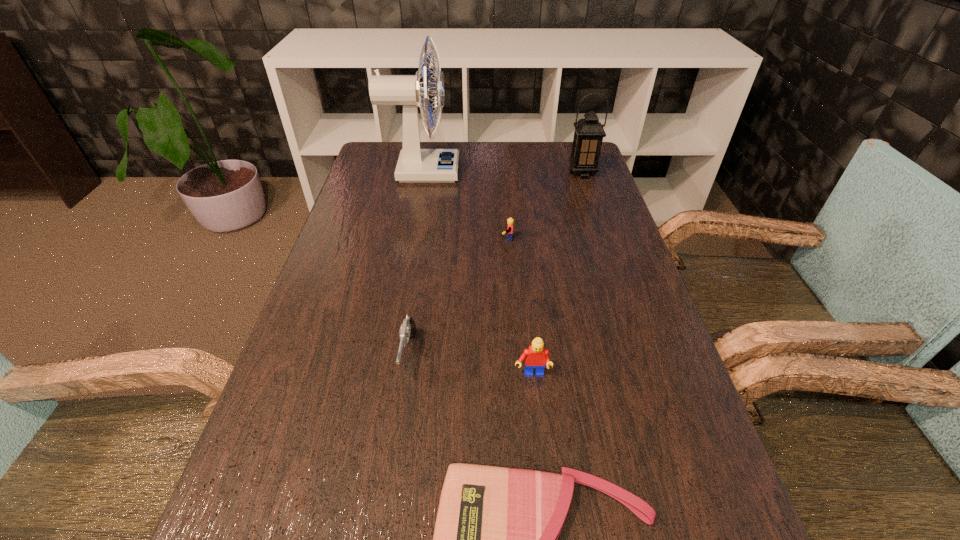
This screenshot has height=540, width=960. Find the location of `fan`. fan is located at coordinates (415, 164).

The height and width of the screenshot is (540, 960). In order to click on lantern in this screenshot , I will do `click(588, 136)`.

Identify the location of the rightmost object. The image size is (960, 540). (588, 136).

Find the location of a particular element. The image size is (960, 540). the nearer Lego is located at coordinates (536, 356).

This screenshot has width=960, height=540. I want to click on the farther Lego, so click(510, 221).

Find the location of a particular element. Image resolution: width=960 pixels, height=540 pixels. gun is located at coordinates (408, 329).

In order to click on free space located 0.360m on the front-facing side of the tallest object in this screenshot , I will do `click(570, 172)`.

Identify the location of vacant space located 0.150m on the left of the rightmost object. The height and width of the screenshot is (540, 960). (521, 173).

The width and height of the screenshot is (960, 540). I want to click on free space located on the front-facing side of the nearer Lego, so click(542, 484).

This screenshot has height=540, width=960. What are the coordinates of `blank space located 0.140m on the front-facing side of the fourth nearest object` in the screenshot? It's located at (440, 239).